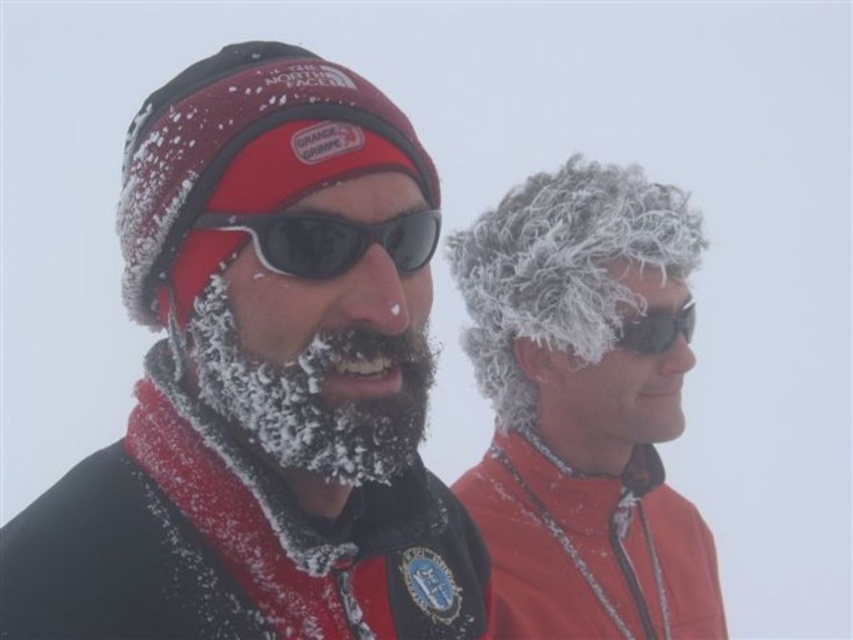
Is white frosty beard at center below black plastic sunglasses at center?

Correct, white frosty beard at center is located below black plastic sunglasses at center.

Is point (252, 368) less distant than point (306, 266)?

No, (252, 368) is behind (306, 266).

Image resolution: width=853 pixels, height=640 pixels. In order to click on white frosty beard at center in this screenshot , I will do `click(312, 394)`.

Locate an element on the screen. The width and height of the screenshot is (853, 640). white frosty beard at center is located at coordinates (312, 394).

Which is more to the right, matte black jacket at center or white frosty beard at center?

white frosty beard at center is more to the right.

The image size is (853, 640). Find the location of `matte black jacket at center`. matte black jacket at center is located at coordinates (263, 384).

Image resolution: width=853 pixels, height=640 pixels. I want to click on matte black jacket at center, so click(x=263, y=384).

You are a GUI agent. You are given a task and a screenshot of the screen. Output one action in this format:
    pyautogui.click(x=<x>, y=<y>)
    Task: Click on the matte black jacket at center
    The width and height of the screenshot is (853, 640).
    Given the screenshot: What is the action you would take?
    pyautogui.click(x=263, y=384)

Between point (685, 260) and point (303, 241), which one is positioned behind?

The point (685, 260) is more distant.

Can you confirm if curly hair at right is positioned above black plastic sunglasses at center?

No.

You are a GUI agent. You are given a task and a screenshot of the screen. Output one action in this format:
    pyautogui.click(x=<x>, y=<y>)
    Task: Click on the curly hair at right
    The height and width of the screenshot is (640, 853).
    Given the screenshot: What is the action you would take?
    pyautogui.click(x=583, y=410)